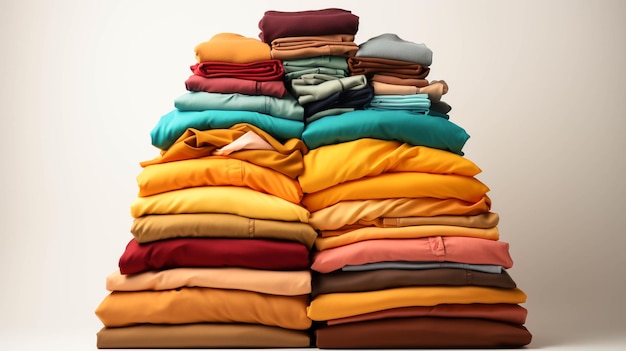
In order to click on orange folded pieces of clothing in this screenshot , I will do `click(252, 187)`, `click(270, 156)`, `click(316, 153)`, `click(240, 50)`, `click(381, 189)`, `click(414, 295)`, `click(272, 309)`, `click(269, 206)`, `click(337, 212)`, `click(404, 231)`.